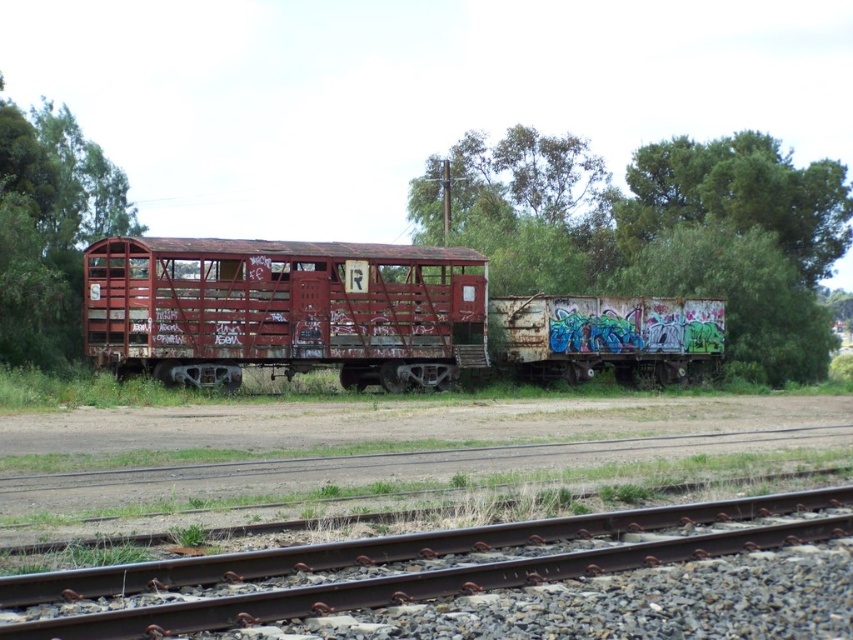
Question: Which object is positioned closest to the green leafy tree at left?

Choices:
 (A) green leafy tree at center
 (B) rusty metal train car at center

Answer: (B)

Question: Which point is closer to the camera taking this photo?

Choices:
 (A) (465, 195)
 (B) (468, 349)

Answer: (B)

Question: Considering the relative positions of rusty metal train car at center and green leafy tree at left in the image provided, where is rusty metal train car at center located with respect to green leafy tree at left?

Choices:
 (A) below
 (B) above

Answer: (A)

Question: Can you confirm if green leafy tree at center is positioned to the right of green leafy tree at left?

Choices:
 (A) yes
 (B) no

Answer: (A)

Question: Can you confirm if green leafy tree at center is smaller than green leafy tree at left?

Choices:
 (A) no
 (B) yes

Answer: (A)

Question: Which point is closer to the camera taking this photo?

Choices:
 (A) (44, 328)
 (B) (811, 285)
 (C) (323, 328)

Answer: (A)